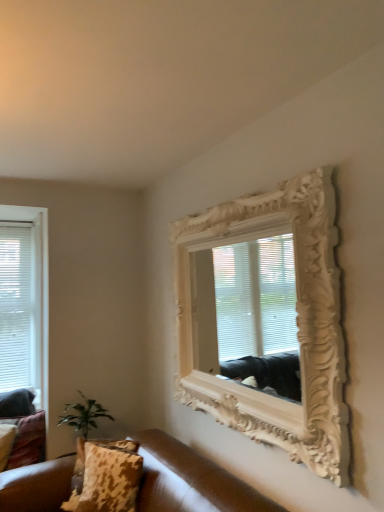
In order to face white carved wood mirror at upper right, should I rotate leftwards or rightwards?

You should rotate right by 4.787 degrees.

Locate an element on the screen. leopard print fabric pillow at lower left, placed as the second pillow when sorted from front to back is located at coordinates [6, 442].

Describe the element at coordinates (190, 480) in the screenshot. I see `brown leather couch at lower left` at that location.

Describe the element at coordinates (28, 441) in the screenshot. The height and width of the screenshot is (512, 384). I see `leopard print fabric pillow at lower left, marked as the 3th pillow in a front-to-back arrangement` at that location.

Image resolution: width=384 pixels, height=512 pixels. In order to click on white carved wood mirror at upper right in this screenshot , I will do `click(267, 319)`.

From a real-world perspective, relative to green leafy plant at lower left, is leopard print fabric pillow at lower left, which ranks as the second pillow in left-to-right order, vertically above or below?

leopard print fabric pillow at lower left, which ranks as the second pillow in left-to-right order, is below green leafy plant at lower left.

Is leopard print fabric pillow at lower left, marked as the 3th pillow in a front-to-back arrangement, inside or outside of green leafy plant at lower left?

leopard print fabric pillow at lower left, marked as the 3th pillow in a front-to-back arrangement, is located beyond the bounds of green leafy plant at lower left.

Considering their positions, is leopard print fabric pillow at lower left, which ranks as the second pillow in left-to-right order, located in front of or behind green leafy plant at lower left?

leopard print fabric pillow at lower left, which ranks as the second pillow in left-to-right order, is positioned farther from the viewer than green leafy plant at lower left.

From a real-world perspective, which is physically above, leopard print fabric pillow at lower left, marked as the 3th pillow in a front-to-back arrangement, or brown leather couch at lower left?

leopard print fabric pillow at lower left, marked as the 3th pillow in a front-to-back arrangement, is physically above.

Which of these two, leopard print fabric pillow at lower left, which appears as the 2th pillow when viewed from the right, or brown leather couch at lower left, is bigger?

brown leather couch at lower left is bigger.

Is point (44, 433) behind point (172, 472)?

Yes, it is behind point (172, 472).

From the image's perspective, would you say leopard print fabric pillow at lower left, marked as the 1th pillow in a left-to-right arrangement, is shown under leopard print fabric pillow at lower left, the first pillow viewed from the back?

Yes, from the image's perspective, leopard print fabric pillow at lower left, marked as the 1th pillow in a left-to-right arrangement, is below leopard print fabric pillow at lower left, the first pillow viewed from the back.

Is leopard print fabric pillow at lower left, marked as the 1th pillow in a left-to-right arrangement, outside of leopard print fabric pillow at lower left, which appears as the 2th pillow when viewed from the right?

No, leopard print fabric pillow at lower left, marked as the 1th pillow in a left-to-right arrangement, is inside leopard print fabric pillow at lower left, which appears as the 2th pillow when viewed from the right,'s boundary.

Between leopard print fabric pillow at lower left, marked as the 1th pillow in a left-to-right arrangement, and leopard print fabric pillow at lower left, marked as the 3th pillow in a front-to-back arrangement, which one has less height?

With less height is leopard print fabric pillow at lower left, marked as the 1th pillow in a left-to-right arrangement.

How many degrees apart are the facing directions of leopard print fabric pillow at lower left, marked as the 1th pillow in a left-to-right arrangement, and leopard print fabric pillow at lower left, the first pillow viewed from the back?

There is a 21.7-degree angle between the facing directions of leopard print fabric pillow at lower left, marked as the 1th pillow in a left-to-right arrangement, and leopard print fabric pillow at lower left, the first pillow viewed from the back.

Which of these two, brown leather couch at lower left or white carved wood mirror at upper right, stands taller?

white carved wood mirror at upper right.

Between brown leather couch at lower left and white carved wood mirror at upper right, which one has smaller size?

Smaller between the two is white carved wood mirror at upper right.

Does brown leather couch at lower left appear on the left side of white carved wood mirror at upper right?

Indeed, brown leather couch at lower left is positioned on the left side of white carved wood mirror at upper right.

From a real-world perspective, relative to white carved wood mirror at upper right, is brown leather couch at lower left vertically above or below?

brown leather couch at lower left is below white carved wood mirror at upper right.

Locate an element on the screen. picture frame that appears on the right of brown leather couch at lower left is located at coordinates (267, 319).

Considering the relative positions of white carved wood mirror at upper right and brown leather couch at lower left in the image provided, is white carved wood mirror at upper right in front of brown leather couch at lower left?

No, it is not.

From a real-world perspective, is white carved wood mirror at upper right physically above brown leather couch at lower left?

Yes.

Between white carved wood mirror at upper right and brown leather couch at lower left, which one has smaller size?

Smaller between the two is white carved wood mirror at upper right.

Is the depth of brown leather couch at lower left greater than that of green leafy plant at lower left?

No, it is in front of green leafy plant at lower left.

Is brown leather couch at lower left turned away from green leafy plant at lower left?

No.

How far apart are brown leather couch at lower left and green leafy plant at lower left?

brown leather couch at lower left and green leafy plant at lower left are 32.71 inches apart from each other.

From the picture: Is leopard print fabric pillow at lower left, the third pillow from the left, smaller than brown leather couch at lower left?

Indeed, leopard print fabric pillow at lower left, the third pillow from the left, has a smaller size compared to brown leather couch at lower left.

Between leopard print fabric pillow at lower left, which is the 1th pillow from front to back, and brown leather couch at lower left, which one appears on the left side from the viewer's perspective?

leopard print fabric pillow at lower left, which is the 1th pillow from front to back, is more to the left.

Which object is wider, leopard print fabric pillow at lower left, which is the 1th pillow from front to back, or brown leather couch at lower left?

Wider between the two is brown leather couch at lower left.

This screenshot has width=384, height=512. In the image, there is a leopard print fabric pillow at lower left, marked as the 3th pillow in a front-to-back arrangement. What are the coordinates of `houseplant above it (from the image's perspective)` in the screenshot? It's located at (83, 415).

Locate an element on the screen. This screenshot has height=512, width=384. studio couch beneath the leopard print fabric pillow at lower left, the first pillow viewed from the back (from a real-world perspective) is located at coordinates (190, 480).

Based on their spatial positions, is brown leather couch at lower left or leopard print fabric pillow at lower left, which ranks as the second pillow in left-to-right order, further from leopard print fabric pillow at lower left, the second pillow positioned from the back?

brown leather couch at lower left.

Considering their positions, is leopard print fabric pillow at lower left, placed as the second pillow when sorted from front to back, positioned closer to leopard print fabric pillow at lower left, which ranks as the second pillow in left-to-right order, than white carved wood mirror at upper right?

leopard print fabric pillow at lower left, placed as the second pillow when sorted from front to back, lies closer to leopard print fabric pillow at lower left, which ranks as the second pillow in left-to-right order, than the other object.

Estimate the real-world distances between objects in this image. Which object is further from brown leather couch at lower left, leopard print fabric pillow at lower left, which is the 1th pillow from front to back, or white carved wood mirror at upper right?

The object further to brown leather couch at lower left is white carved wood mirror at upper right.

Based on their spatial positions, is brown leather couch at lower left or green leafy plant at lower left further from leopard print fabric pillow at lower left, marked as the 1th pillow in a left-to-right arrangement?

brown leather couch at lower left is further to leopard print fabric pillow at lower left, marked as the 1th pillow in a left-to-right arrangement.

When comparing their distances from leopard print fabric pillow at lower left, marked as the 1th pillow in a left-to-right arrangement, does green leafy plant at lower left or leopard print fabric pillow at lower left, which ranks as the second pillow in left-to-right order, seem closer?

Among the two, leopard print fabric pillow at lower left, which ranks as the second pillow in left-to-right order, is located nearer to leopard print fabric pillow at lower left, marked as the 1th pillow in a left-to-right arrangement.

Based on their spatial positions, is leopard print fabric pillow at lower left, which is the 1th pillow from front to back, or green leafy plant at lower left further from brown leather couch at lower left?

Among the two, green leafy plant at lower left is located further to brown leather couch at lower left.

Looking at the image, which one is located further to brown leather couch at lower left, leopard print fabric pillow at lower left, placed as the second pillow when sorted from front to back, or leopard print fabric pillow at lower left, which appears as the 2th pillow when viewed from the right?

Among the two, leopard print fabric pillow at lower left, placed as the second pillow when sorted from front to back, is located further to brown leather couch at lower left.

Estimate the real-world distances between objects in this image. Which object is further from green leafy plant at lower left, brown leather couch at lower left or leopard print fabric pillow at lower left, which appears as the 2th pillow when viewed from the right?

Among the two, brown leather couch at lower left is located further to green leafy plant at lower left.

This screenshot has width=384, height=512. Identify the location of houseplant between leopard print fabric pillow at lower left, positioned as the 1th pillow in right-to-left order, and leopard print fabric pillow at lower left, which appears as the 2th pillow when viewed from the right, along the z-axis. (83, 415).

The image size is (384, 512). Identify the location of houseplant situated between leopard print fabric pillow at lower left, the second pillow positioned from the back, and leopard print fabric pillow at lower left, positioned as the 1th pillow in right-to-left order, from left to right. (83, 415).

This screenshot has height=512, width=384. Find the location of `pillow between white carved wood mirror at upper right and green leafy plant at lower left from front to back`. pillow between white carved wood mirror at upper right and green leafy plant at lower left from front to back is located at coordinates (109, 479).

Where is `picture frame between brown leather couch at lower left and leopard print fabric pillow at lower left, the second pillow positioned from the back, in the front-back direction`? picture frame between brown leather couch at lower left and leopard print fabric pillow at lower left, the second pillow positioned from the back, in the front-back direction is located at coordinates (267, 319).